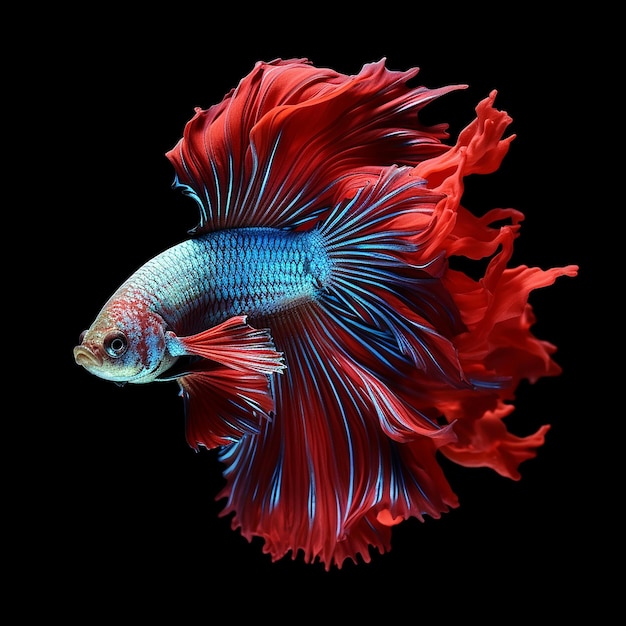
Locate an element on the screen. scales is located at coordinates (220, 290).